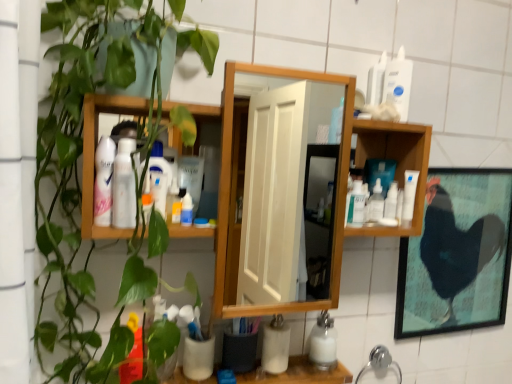
Question: Is the depth of white matte cup at lower center greater than that of green matte plant at left?

Choices:
 (A) yes
 (B) no

Answer: (A)

Question: Does white matte cup at lower center touch green matte plant at left?

Choices:
 (A) no
 (B) yes

Answer: (A)

Question: Does white matte cup at lower center have a greater width compared to green matte plant at left?

Choices:
 (A) yes
 (B) no

Answer: (B)

Question: Can you confirm if white matte cup at lower center is positioned to the left of green matte plant at left?

Choices:
 (A) no
 (B) yes

Answer: (A)

Question: From a real-world perspective, is white matte cup at lower center positioned under green matte plant at left based on gravity?

Choices:
 (A) no
 (B) yes

Answer: (B)

Question: From the image's perspective, is white matte cup at lower center below green matte plant at left?

Choices:
 (A) yes
 (B) no

Answer: (A)

Question: Is white matte cup at lower center, acting as the first toiletry starting from the bottom, completely or partially inside translucent plastic spray bottle at center, positioned as the 4th cleaning product in bottom-to-top order?

Choices:
 (A) yes
 (B) no

Answer: (B)

Question: Can you confirm if translucent plastic spray bottle at center, positioned as the 4th cleaning product in bottom-to-top order, is thinner than white matte cup at lower center, the second toiletry positioned from the right?

Choices:
 (A) yes
 (B) no

Answer: (A)

Question: Does translucent plastic spray bottle at center, the 1th cleaning product viewed from the left, have a greater height compared to white matte cup at lower center, the second toiletry positioned from the back?

Choices:
 (A) yes
 (B) no

Answer: (A)

Question: Considering the relative positions of translucent plastic spray bottle at center, marked as the first cleaning product in a front-to-back arrangement, and white matte cup at lower center, arranged as the 3th toiletry when viewed from the left, in the image provided, is translucent plastic spray bottle at center, marked as the first cleaning product in a front-to-back arrangement, behind white matte cup at lower center, arranged as the 3th toiletry when viewed from the left,?

Choices:
 (A) no
 (B) yes

Answer: (A)

Question: Considering the relative sizes of translucent plastic spray bottle at center, the fourth cleaning product when ordered from back to front, and white matte cup at lower center, acting as the first toiletry starting from the bottom, in the image provided, is translucent plastic spray bottle at center, the fourth cleaning product when ordered from back to front, wider than white matte cup at lower center, acting as the first toiletry starting from the bottom,?

Choices:
 (A) no
 (B) yes

Answer: (A)

Question: Can you confirm if translucent plastic spray bottle at center, the fourth cleaning product when ordered from back to front, is bigger than white matte cup at lower center, which is the 4th toiletry in top-to-bottom order?

Choices:
 (A) yes
 (B) no

Answer: (B)

Question: Would you say clear plastic bottle at center-right, the 3th cleaning product in the left-to-right sequence, contains green matte plant at left?

Choices:
 (A) no
 (B) yes

Answer: (A)